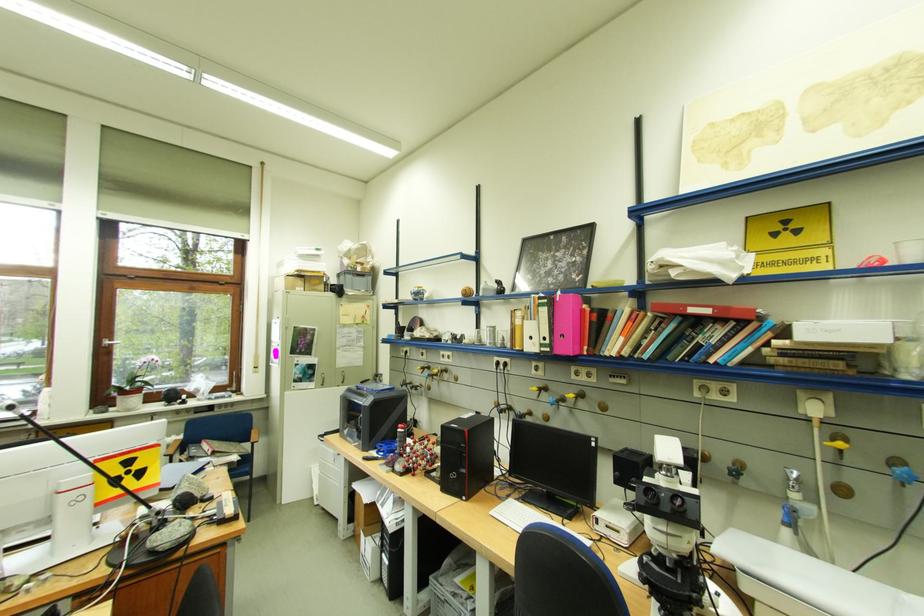
The height and width of the screenshot is (616, 924). What do you see at coordinates (901, 469) in the screenshot?
I see `a blue valve handle` at bounding box center [901, 469].